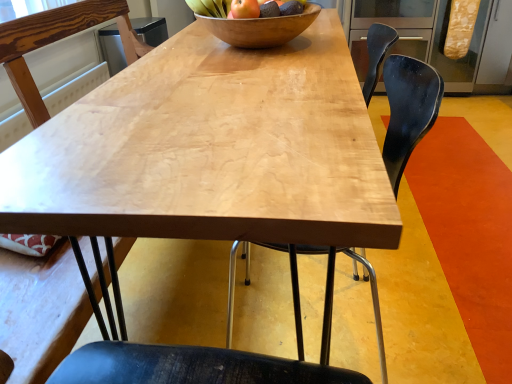
Question: Can you confirm if matte brown apple at center is wider than black matte chair at center, placed as the 2th chair when sorted from right to left?

Choices:
 (A) no
 (B) yes

Answer: (A)

Question: Can you confirm if matte brown apple at center is shorter than black matte chair at center, which is counted as the second chair, starting from the left?

Choices:
 (A) no
 (B) yes

Answer: (B)

Question: Is matte brown apple at center to the left of black matte chair at center, placed as the 2th chair when sorted from right to left, from the viewer's perspective?

Choices:
 (A) yes
 (B) no

Answer: (A)

Question: Does matte brown apple at center have a larger size compared to black matte chair at center, placed as the 2th chair when sorted from right to left?

Choices:
 (A) no
 (B) yes

Answer: (A)

Question: Would you say matte brown apple at center is a long distance from black matte chair at center, which is counted as the second chair, starting from the left?

Choices:
 (A) no
 (B) yes

Answer: (A)

Question: From a real-world perspective, is matte brown apple at center physically above black matte chair at center, placed as the 2th chair when sorted from right to left?

Choices:
 (A) no
 (B) yes

Answer: (B)

Question: Is wooden bowl at center positioned beyond the bounds of matte brown apple at center?

Choices:
 (A) yes
 (B) no

Answer: (A)

Question: Can you confirm if wooden bowl at center is thinner than matte brown apple at center?

Choices:
 (A) yes
 (B) no

Answer: (B)

Question: Is wooden bowl at center surrounding matte brown apple at center?

Choices:
 (A) no
 (B) yes

Answer: (B)

Question: From the image's perspective, is wooden bowl at center under matte brown apple at center?

Choices:
 (A) no
 (B) yes

Answer: (A)

Question: Considering the relative sizes of wooden bowl at center and matte brown apple at center in the image provided, is wooden bowl at center taller than matte brown apple at center?

Choices:
 (A) yes
 (B) no

Answer: (A)

Question: Does wooden bowl at center turn towards matte brown apple at center?

Choices:
 (A) yes
 (B) no

Answer: (B)

Question: Is the depth of black matte chair at center, placed as the 2th chair when sorted from right to left, less than that of matte brown apple at center?

Choices:
 (A) no
 (B) yes

Answer: (B)